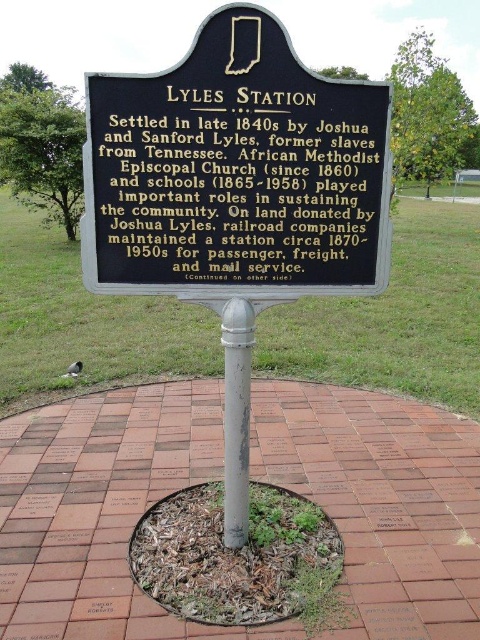
You are standing at the center of the circular brick area and want to place a new plaque exactly at the point marked as point (236, 172). Given that the marker is already at the center, can you still place the new plaque at that point without overlapping?

The point (236, 172) is where the black metal sign at center is located, so placing the new plaque there would overlap with the existing marker.

You are a visitor at Lyles Station historical site and want to take a photo of the black metal sign at center and the silver metallic pole at center. Which object should you focus on first to ensure both are in the frame?

The black metal sign at center is in front of the silver metallic pole at center. To ensure both are in the frame, focus on the black metal sign at center first as it is closer to the camera, allowing the pole behind it to still be visible in the background.

You are a visitor at the historical site and want to take a photo of the black metal sign at center and the silver metallic pole at center. Which object should you focus on first if you want to capture both in a single frame without moving your camera?

The black metal sign at center is located above the silver metallic pole at center, so you should focus on the silver metallic pole at center first to ensure both are in frame.